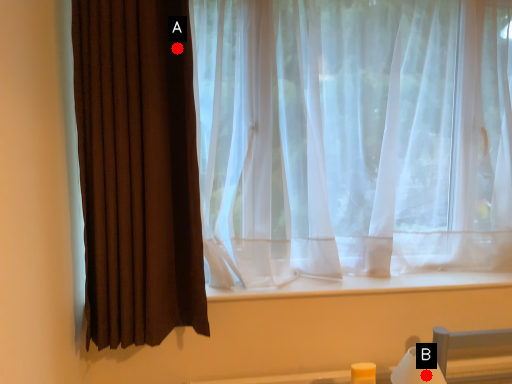
Question: Two points are circled on the image, labeled by A and B beside each circle. Which point is further to the camera?

Choices:
 (A) A is further
 (B) B is further

Answer: (B)